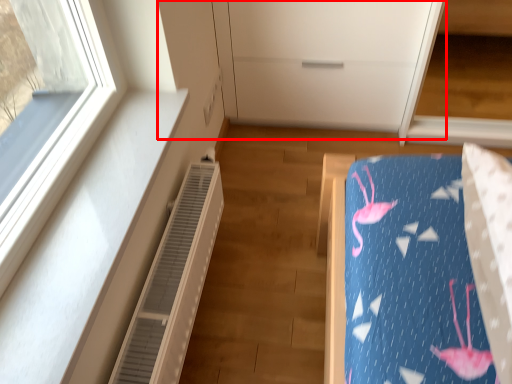
Question: From the image's perspective, what is the correct spatial relationship of dresser (annotated by the red box) in relation to air conditioner?

Choices:
 (A) below
 (B) above

Answer: (B)